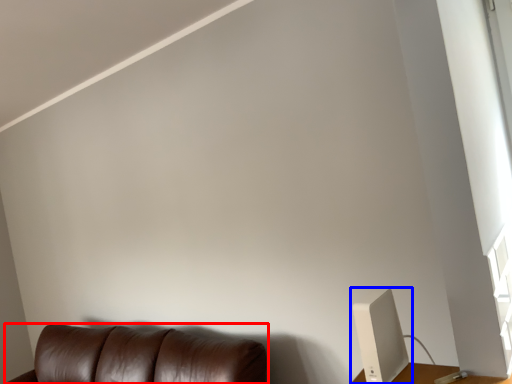
Question: Among these objects, which one is farthest to the camera, furniture (highlighted by a red box) or computer monitor (highlighted by a blue box)?

Choices:
 (A) furniture
 (B) computer monitor

Answer: (A)